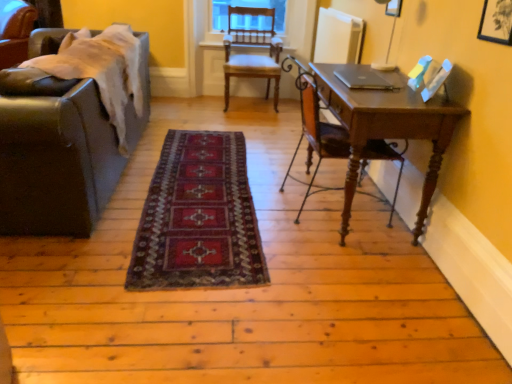
Locate an element on the screen. The width and height of the screenshot is (512, 384). free space in front of dark red woven rug at center is located at coordinates (212, 294).